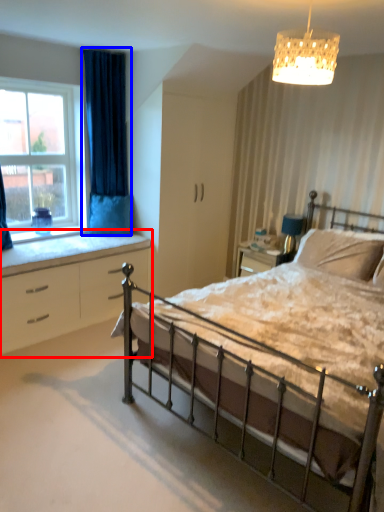
Question: Which of the following is the closest to the observer, chest of drawers (highlighted by a red box) or curtain (highlighted by a blue box)?

Choices:
 (A) chest of drawers
 (B) curtain

Answer: (A)